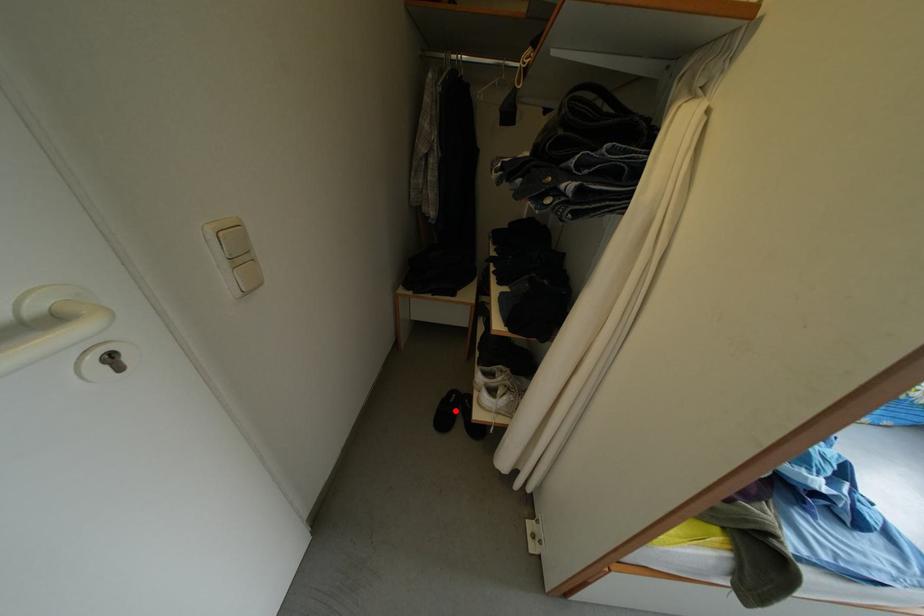
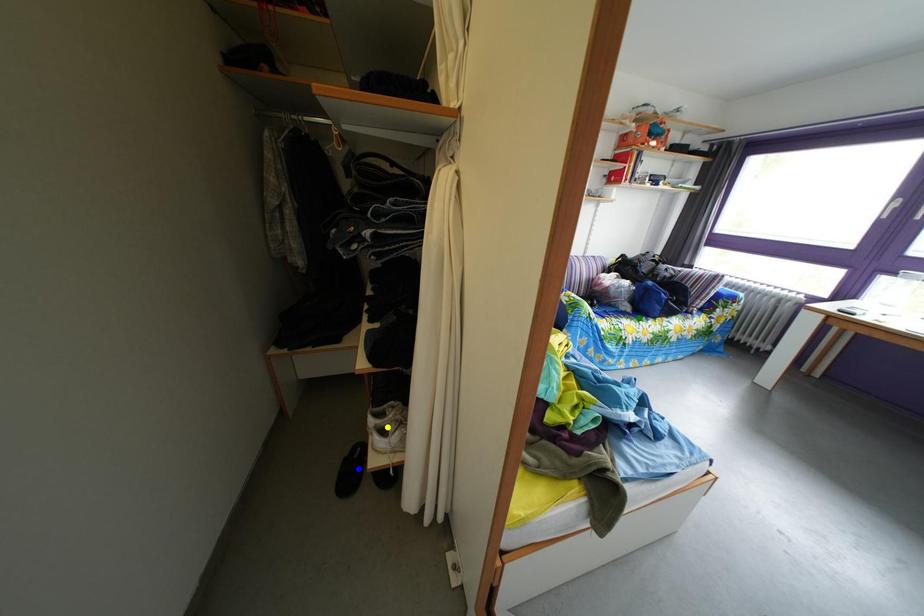
Question: I am providing you with two images of the same scene from different viewpoints. A red point is marked on the first image. You are given multiple points on the second image. Which point in image 2 is actually the same real-world point as the red point in image 1?

Choices:
 (A) blue point
 (B) green point
 (C) yellow point

Answer: (A)